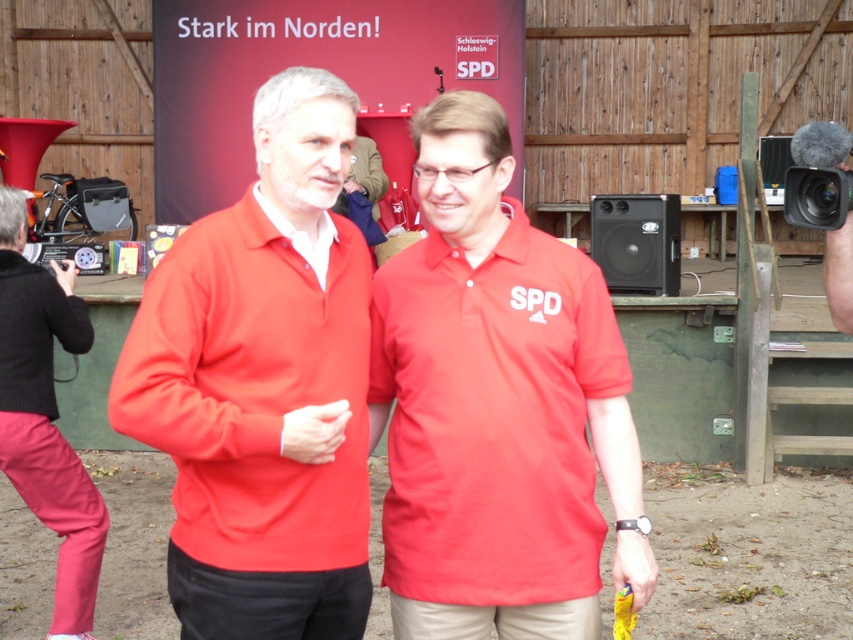
You are a photographer at a political event. You need to capture a photo of the matte red polo shirt at center without including the black plastic video camera at upper right in the frame. Is this possible based on their positions?

The matte red polo shirt at center is below the black plastic video camera at upper right, so adjusting the camera angle downward should allow you to exclude the black plastic video camera at upper right while capturing the matte red polo shirt at center.

You are a photographer at a political event. You need to capture a clear photo of the matte red polo shirt at center without the black plastic video camera at upper right appearing in the frame. Is this possible based on their positions?

The matte red polo shirt at center is closer to the viewer than the black plastic video camera at upper right. Therefore, positioning the camera to focus on the matte red polo shirt at center while angling away from the black plastic video camera at upper right would allow capturing the shirt without the camera in the frame.